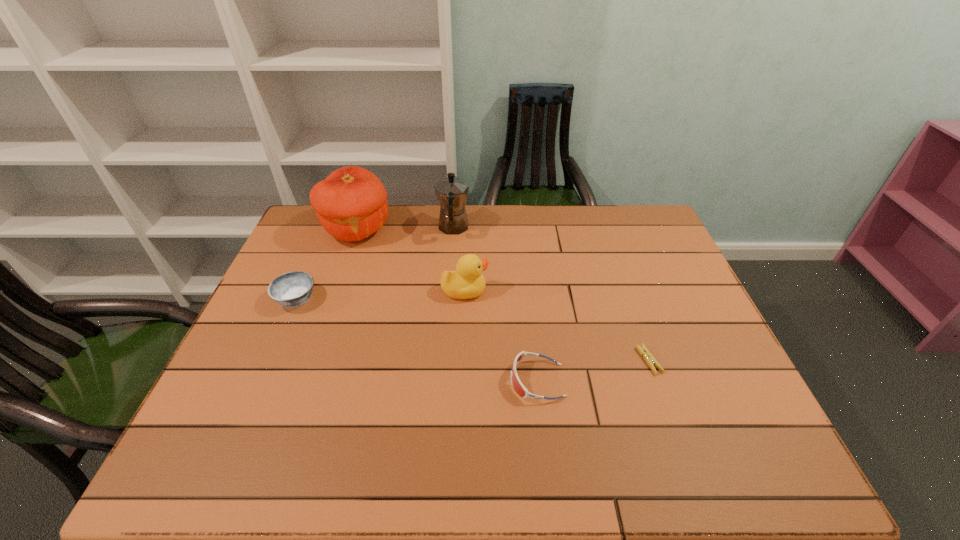
Where is `free location located on the front-facing side of the second object from right to left`? free location located on the front-facing side of the second object from right to left is located at coordinates [x=421, y=381].

Locate an element on the screen. free space located on the front-facing side of the second object from right to left is located at coordinates point(472,381).

What are the coordinates of `vacant space situated 0.360m on the front-facing side of the second object from right to left` in the screenshot? It's located at (x=358, y=381).

Where is `blank space located 0.170m on the left of the shortest object`? blank space located 0.170m on the left of the shortest object is located at coordinates (570, 361).

Where is `pumpkin that is at the far edge`? pumpkin that is at the far edge is located at coordinates (351, 204).

Where is `coffeepot that is at the far edge`? Image resolution: width=960 pixels, height=540 pixels. coffeepot that is at the far edge is located at coordinates (452, 192).

In order to click on pumpkin that is at the left edge in this screenshot , I will do `click(351, 204)`.

Where is `ashtray located in the left edge section of the desktop`? The width and height of the screenshot is (960, 540). ashtray located in the left edge section of the desktop is located at coordinates click(x=292, y=289).

What are the coordinates of `object that is at the far left corner` in the screenshot? It's located at (351, 204).

In the image, there is a desktop. Where is `free space at the far edge`? The height and width of the screenshot is (540, 960). free space at the far edge is located at coordinates (388, 240).